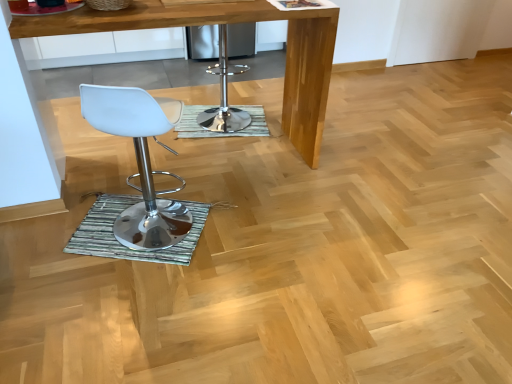
The image size is (512, 384). Identify the location of blank space situated above green textured mat at center, the 1th mat when ordered from top to bottom (from a real-world perspective). (231, 119).